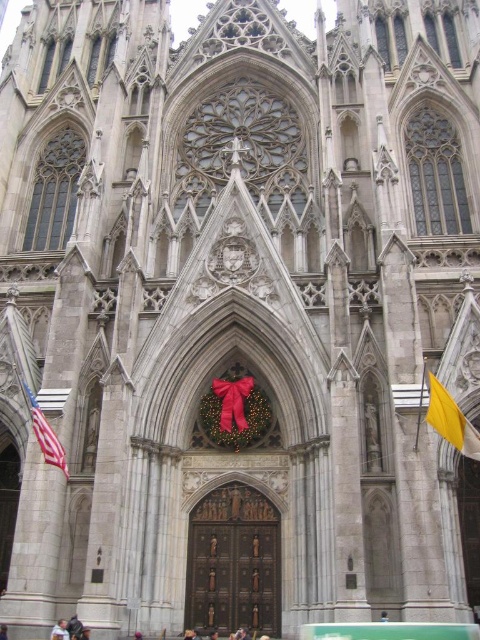
You are standing in front of the cathedral and notice a yellow fabric flag at right. Based on its position, can you determine if it is placed near the top or bottom of the cathedral facade?

The yellow fabric flag at right is located at point coordinates that indicate it is near the bottom of the cathedral facade since the y coordinate 0.940 is closer to 1, which typically represents the bottom in image coordinate systems.

Looking at this image, you are standing in front of the cathedral and see the american flag at left and the light blue shirt at center. Which object is closer to the viewer?

The american flag at left is closer to the viewer than the light blue shirt at center.